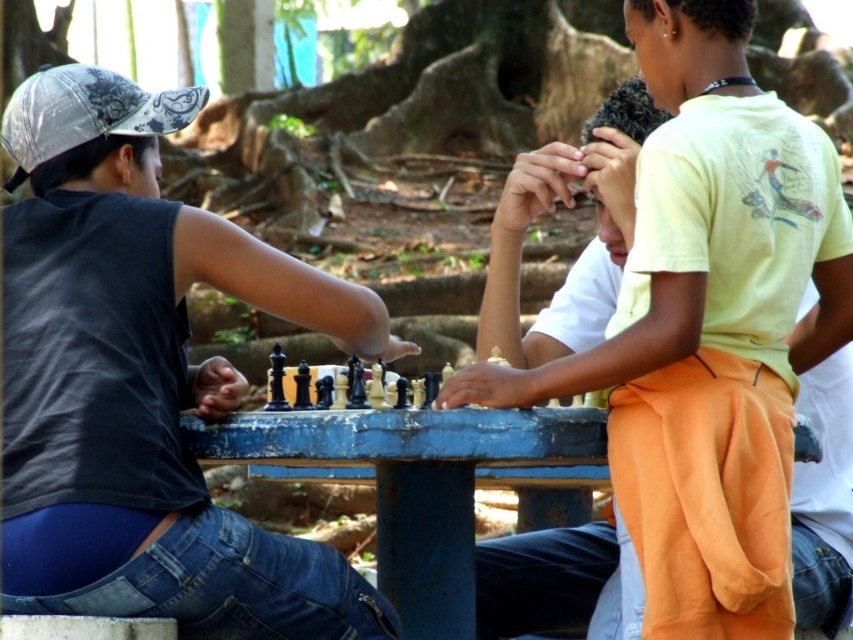
Question: Is matte black chess set at center thinner than light yellow t-shirt at center?

Choices:
 (A) yes
 (B) no

Answer: (A)

Question: Does matte black chess set at center appear under light yellow t-shirt at center?

Choices:
 (A) yes
 (B) no

Answer: (A)

Question: Considering the relative positions of matte black chess set at center and light yellow t-shirt at center in the image provided, where is matte black chess set at center located with respect to light yellow t-shirt at center?

Choices:
 (A) above
 (B) below

Answer: (B)

Question: Among these points, which one is farthest from the camera?

Choices:
 (A) (585, 134)
 (B) (22, 534)

Answer: (A)